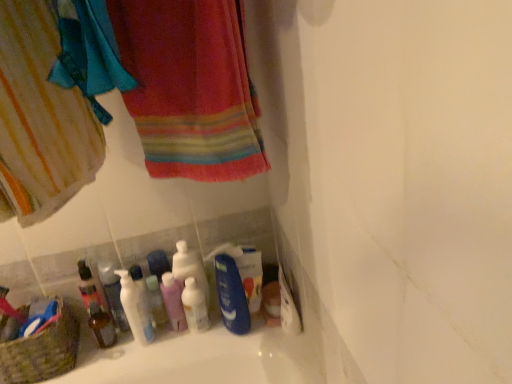
Question: Is point (22, 349) positioned closer to the camera than point (144, 319)?

Choices:
 (A) farther
 (B) closer

Answer: (B)

Question: In terms of width, does textured wicker basket at lower left look wider or thinner when compared to white glossy pump bottle at lower left, marked as the 1th cleaning product in a left-to-right arrangement?

Choices:
 (A) wide
 (B) thin

Answer: (A)

Question: Which object is the farthest from the pink plastic mouthwash at center, the 3th mouthwash from the left?

Choices:
 (A) white glossy bottle at center, the second cleaning product when ordered from left to right
 (B) multicolored woven towel at upper left
 (C) white glossy mouthwash at center, arranged as the first mouthwash when viewed from the right
 (D) striped cotton towel at upper left
 (E) translucent plastic mouthwash at lower left, the 4th mouthwash in the right-to-left sequence

Answer: (D)

Question: Based on their relative distances, which object is farther from the pink plastic mouthwash at center, positioned as the second mouthwash in right-to-left order?

Choices:
 (A) striped cotton towel at upper left
 (B) white glossy mouthwash at center, arranged as the first mouthwash when viewed from the right
 (C) translucent plastic mouthwash at lower left, the 4th mouthwash in the right-to-left sequence
 (D) white glossy bottle at center, which appears as the 2th cleaning product when viewed from the right
 (E) white glossy pump bottle at lower left, positioned as the 3th cleaning product in right-to-left order

Answer: (A)